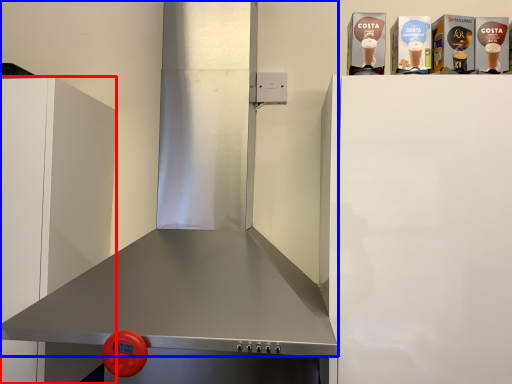
Question: Which object appears closest to the camera in this image, cabinetry (highlighted by a red box) or exhaust hood (highlighted by a blue box)?

Choices:
 (A) cabinetry
 (B) exhaust hood

Answer: (B)